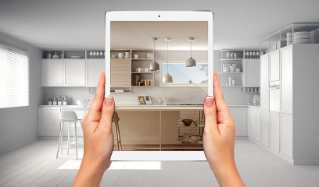
Where is `light grey floor`? This screenshot has width=319, height=187. light grey floor is located at coordinates (41, 169).